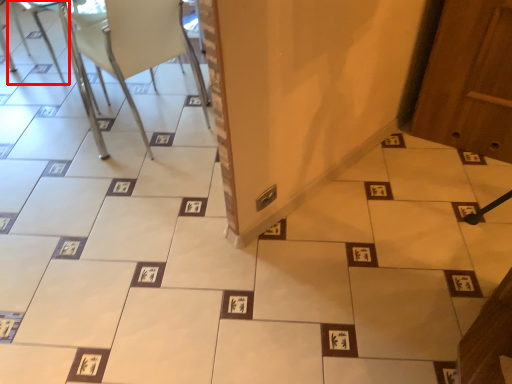
Question: From the image's perspective, where is armchair (annotated by the red box) located in relation to chair in the image?

Choices:
 (A) below
 (B) above

Answer: (B)